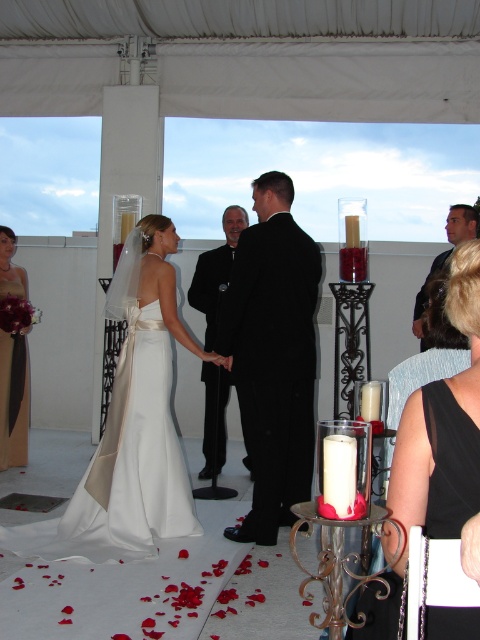
You are a photographer at the wedding ceremony. You need to capture a photo of both the black satin suit at center and the silky satin dress at left. Based on their positions, which one is on the left side of the photo?

The silky satin dress at left is on the left side of the photo because the black satin suit at center is to the right of it.

You are a photographer at the wedding ceremony. You need to capture a photo of the silky satin dress at left and the black satin suit at right. Which of the two occupies less area in the frame?

The silky satin dress at left occupies less space than the black satin suit at right, so it occupies less area in the frame.